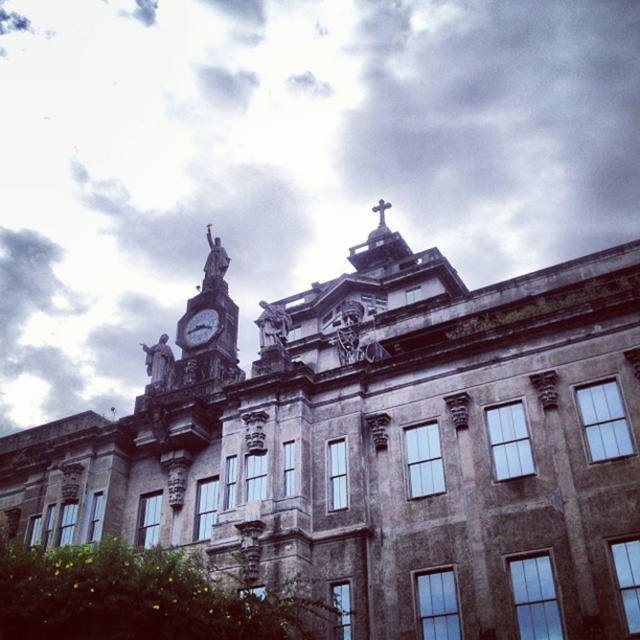
Question: Among these points, which one is farthest from the camera?

Choices:
 (A) (499, 186)
 (B) (204, 321)

Answer: (A)

Question: Where is white cloudy sky at upper center located in relation to metallic gray clock at upper center in the image?

Choices:
 (A) below
 (B) above

Answer: (B)

Question: Can you confirm if white cloudy sky at upper center is positioned above metallic gray clock at upper center?

Choices:
 (A) yes
 (B) no

Answer: (A)

Question: Is white cloudy sky at upper center bigger than metallic gray clock at upper center?

Choices:
 (A) yes
 (B) no

Answer: (A)

Question: Which point is farther to the camera?

Choices:
 (A) metallic gray clock at upper center
 (B) white cloudy sky at upper center

Answer: (B)